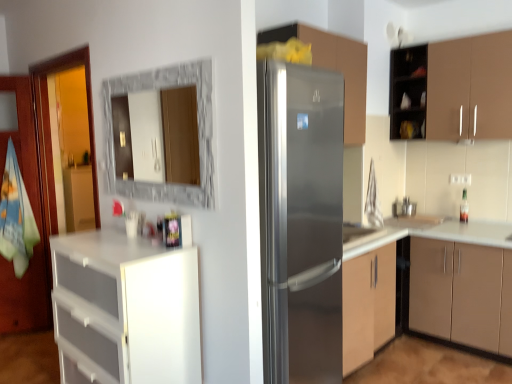
What do you see at coordinates (198, 133) in the screenshot? This screenshot has width=512, height=384. I see `marble frame mirror at upper center` at bounding box center [198, 133].

In order to face satin silver sink at center, should I rotate leftwards or rightwards?

Rotate your view right by about 12.867°.

This screenshot has height=384, width=512. I want to click on satin silver refrigerator at center, which is the 2th cabinetry in left-to-right order, so click(x=334, y=69).

Identify the location of white plastic drawers at left, the 4th cabinetry positioned from the right. Image resolution: width=512 pixels, height=384 pixels. point(128,306).

Find the location of `marble frame mirror at upper center`. marble frame mirror at upper center is located at coordinates (198, 133).

From the picture: Which point is more forward, (275, 108) or (455, 140)?

Point (275, 108)

In order to click on the 3rd cabinetry behind the stainless steel refrigerator at center, counting from the anchor's position in this screenshot , I will do `click(453, 89)`.

Between stainless steel refrigerator at center and brown matte cabinet at upper right, acting as the first cabinetry starting from the right, which one is positioned behind?

brown matte cabinet at upper right, acting as the first cabinetry starting from the right, is further away from the camera.

Considering the relative sizes of stainless steel refrigerator at center and brown matte cabinet at upper right, which is the fourth cabinetry from left to right, in the image provided, is stainless steel refrigerator at center smaller than brown matte cabinet at upper right, which is the fourth cabinetry from left to right,?

Incorrect, stainless steel refrigerator at center is not smaller in size than brown matte cabinet at upper right, which is the fourth cabinetry from left to right.

Who is bigger, satin silver sink at center or marble frame mirror at upper center?

Bigger between the two is marble frame mirror at upper center.

Considering the relative positions of satin silver sink at center and marble frame mirror at upper center in the image provided, is satin silver sink at center behind marble frame mirror at upper center?

Yes, satin silver sink at center is further from the camera.

From the image's perspective, which is below, satin silver sink at center or marble frame mirror at upper center?

satin silver sink at center.

Between satin silver sink at center and marble frame mirror at upper center, which one has larger width?

With larger width is satin silver sink at center.

Is marble frame mirror at upper center looking in the opposite direction of brown matte cabinet at upper right, which is the fourth cabinetry from left to right?

That's right, marble frame mirror at upper center is facing away from brown matte cabinet at upper right, which is the fourth cabinetry from left to right.

Which object is closer to the camera, marble frame mirror at upper center or brown matte cabinet at upper right, which is the fourth cabinetry from left to right?

marble frame mirror at upper center.

Is point (109, 83) positioned after point (412, 81)?

No, (109, 83) is closer to viewer.

Which is more to the right, marble frame mirror at upper center or brown matte cabinet at upper right, which is the fourth cabinetry from left to right?

From the viewer's perspective, brown matte cabinet at upper right, which is the fourth cabinetry from left to right, appears more on the right side.

Considering the relative positions of stainless steel refrigerator at center and satin silver sink at center in the image provided, is stainless steel refrigerator at center to the left of satin silver sink at center from the viewer's perspective?

Yes.

Does stainless steel refrigerator at center touch satin silver sink at center?

No, stainless steel refrigerator at center is not making contact with satin silver sink at center.

Between stainless steel refrigerator at center and satin silver sink at center, which one has larger width?

With larger width is stainless steel refrigerator at center.

Between satin silver sink at center and satin silver refrigerator at center, which is the 2th cabinetry in left-to-right order, which one is positioned in front?

satin silver refrigerator at center, which is the 2th cabinetry in left-to-right order, is in front.

Would you consider satin silver sink at center to be distant from satin silver refrigerator at center, which is the third cabinetry in right-to-left order?

satin silver sink at center is far away from satin silver refrigerator at center, which is the third cabinetry in right-to-left order.

I want to click on sink located underneath the satin silver refrigerator at center, which is the 2th cabinetry in left-to-right order (from a real-world perspective), so click(x=356, y=231).

Choose the correct answer: Is brown matte cabinet at upper right, which is the fourth cabinetry from left to right, inside satin silver sink at center or outside it?

brown matte cabinet at upper right, which is the fourth cabinetry from left to right, is spatially situated outside satin silver sink at center.

From the picture: Considering the sizes of objects brown matte cabinet at upper right, which is the fourth cabinetry from left to right, and satin silver sink at center in the image provided, who is smaller, brown matte cabinet at upper right, which is the fourth cabinetry from left to right, or satin silver sink at center?

Smaller between the two is satin silver sink at center.

Are brown matte cabinet at upper right, acting as the first cabinetry starting from the right, and satin silver sink at center located far from each other?

brown matte cabinet at upper right, acting as the first cabinetry starting from the right, is far away from satin silver sink at center.

Can you tell me how much white plastic drawers at left, the 4th cabinetry positioned from the right, and matte brown cabinet at right, marked as the 2th cabinetry in a right-to-left arrangement, differ in facing direction?

The angle between the facing direction of white plastic drawers at left, the 4th cabinetry positioned from the right, and the facing direction of matte brown cabinet at right, marked as the 2th cabinetry in a right-to-left arrangement, is 0.096 degrees.

Who is shorter, white plastic drawers at left, the 4th cabinetry positioned from the right, or matte brown cabinet at right, marked as the 2th cabinetry in a right-to-left arrangement?

With less height is matte brown cabinet at right, marked as the 2th cabinetry in a right-to-left arrangement.

Is white plastic drawers at left, arranged as the first cabinetry when viewed from the left, positioned with its back to matte brown cabinet at right, acting as the 3th cabinetry starting from the left?

Yes, white plastic drawers at left, arranged as the first cabinetry when viewed from the left,'s orientation is away from matte brown cabinet at right, acting as the 3th cabinetry starting from the left.

In the scene shown: From the image's perspective, is white plastic drawers at left, arranged as the first cabinetry when viewed from the left, below matte brown cabinet at right, marked as the 2th cabinetry in a right-to-left arrangement?

Yes, from the image's perspective, white plastic drawers at left, arranged as the first cabinetry when viewed from the left, is beneath matte brown cabinet at right, marked as the 2th cabinetry in a right-to-left arrangement.

Identify the location of cabinetry that is the 3rd object located behind the stainless steel refrigerator at center. (453, 89).

The height and width of the screenshot is (384, 512). Find the location of `mirror on the left side of satin silver sink at center`. mirror on the left side of satin silver sink at center is located at coordinates (198, 133).

In the scene shown: Which object lies further to the anchor point brown matte cabinet at upper right, which is the fourth cabinetry from left to right, white plastic drawers at left, the 4th cabinetry positioned from the right, or matte brown cabinet at right, acting as the 3th cabinetry starting from the left?

white plastic drawers at left, the 4th cabinetry positioned from the right.

Considering their positions, is white plastic drawers at left, the 4th cabinetry positioned from the right, positioned further to brown matte cabinet at upper right, which is the fourth cabinetry from left to right, than stainless steel refrigerator at center?

The object further to brown matte cabinet at upper right, which is the fourth cabinetry from left to right, is white plastic drawers at left, the 4th cabinetry positioned from the right.

Based on their spatial positions, is satin silver sink at center or brown matte cabinet at upper right, which is the fourth cabinetry from left to right, closer to stainless steel refrigerator at center?

satin silver sink at center is closer to stainless steel refrigerator at center.

Considering their positions, is stainless steel refrigerator at center positioned closer to brown matte cabinet at upper right, which is the fourth cabinetry from left to right, than marble frame mirror at upper center?

stainless steel refrigerator at center lies closer to brown matte cabinet at upper right, which is the fourth cabinetry from left to right, than the other object.

From the picture: Looking at the image, which one is located further to stainless steel refrigerator at center, satin silver sink at center or matte brown cabinet at right, marked as the 2th cabinetry in a right-to-left arrangement?

satin silver sink at center is positioned further to the anchor stainless steel refrigerator at center.

From the picture: When comparing their distances from satin silver sink at center, does brown matte cabinet at upper right, which is the fourth cabinetry from left to right, or satin silver refrigerator at center, which is the third cabinetry in right-to-left order, seem closer?

Among the two, satin silver refrigerator at center, which is the third cabinetry in right-to-left order, is located nearer to satin silver sink at center.

From the picture: Which object lies further to the anchor point white plastic drawers at left, arranged as the first cabinetry when viewed from the left, satin silver sink at center or marble frame mirror at upper center?

satin silver sink at center is further to white plastic drawers at left, arranged as the first cabinetry when viewed from the left.

From the image, which object appears to be nearer to white plastic drawers at left, arranged as the first cabinetry when viewed from the left, satin silver sink at center or brown matte cabinet at upper right, acting as the first cabinetry starting from the right?

satin silver sink at center is closer to white plastic drawers at left, arranged as the first cabinetry when viewed from the left.

The width and height of the screenshot is (512, 384). Identify the location of cabinetry situated between white plastic drawers at left, the 4th cabinetry positioned from the right, and matte brown cabinet at right, marked as the 2th cabinetry in a right-to-left arrangement, from left to right. (334, 69).

In order to click on refrigerator between marble frame mirror at upper center and satin silver refrigerator at center, which is the third cabinetry in right-to-left order, in the horizontal direction in this screenshot , I will do `click(300, 221)`.

Where is `mirror located between white plastic drawers at left, arranged as the first cabinetry when viewed from the left, and satin silver sink at center in the left-right direction`? The height and width of the screenshot is (384, 512). mirror located between white plastic drawers at left, arranged as the first cabinetry when viewed from the left, and satin silver sink at center in the left-right direction is located at coordinates (198, 133).

This screenshot has width=512, height=384. Identify the location of cabinetry situated between white plastic drawers at left, the 4th cabinetry positioned from the right, and satin silver sink at center from left to right. (334, 69).